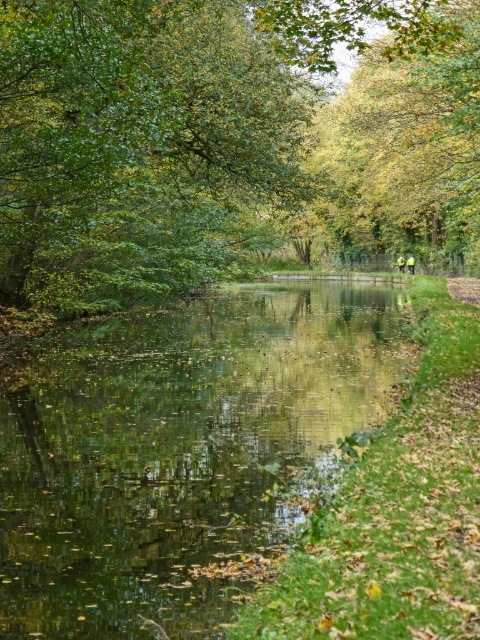
You are standing on the grassy path and want to take a photo of the green leafy tree at center and the green reflective water at center. Which object will appear larger in the photo if you focus on the tree first?

The green leafy tree at center will appear larger in the photo because it is positioned over the green reflective water at center, making it closer to the camera compared to the water below.

You are standing on the grassy path and want to cross the green reflective water at center. The green leafy tree at center is blocking your path. Can you walk around the tree to reach the water?

The green leafy tree at center is wider than the green reflective water at center, so it might block your path. You might need to find another route or go further around the tree to reach the water.